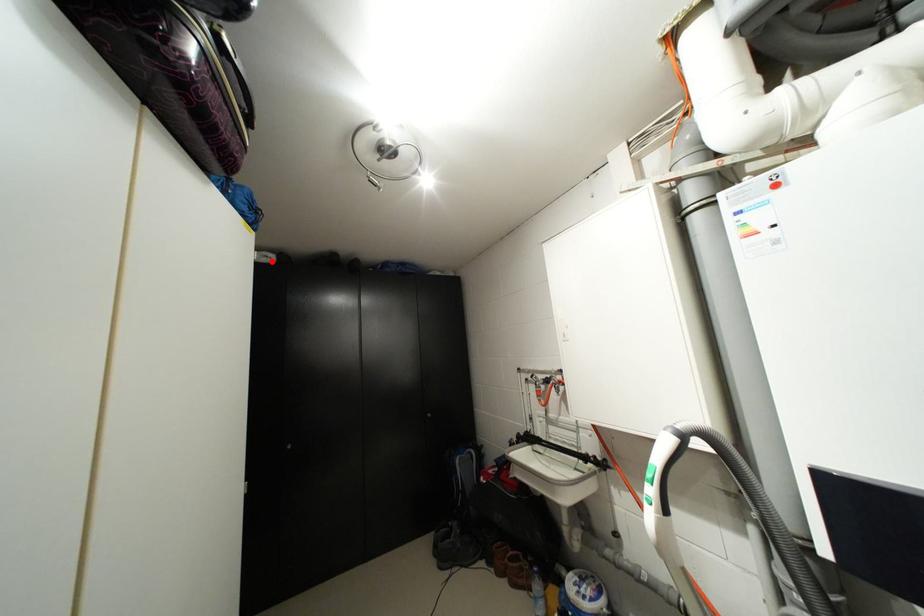
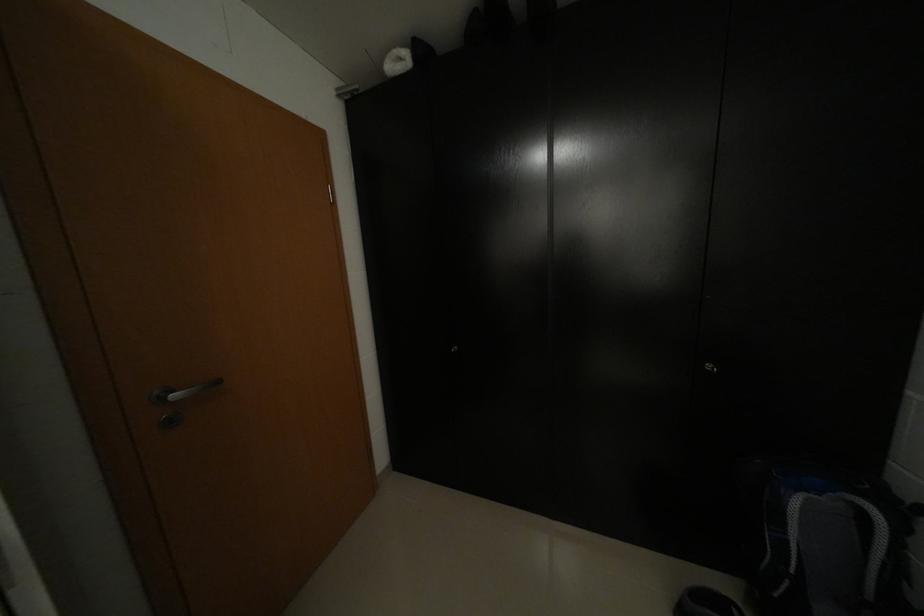
In the second image, find the point that corresponds to the highlighted location in the first image.

(407, 70)